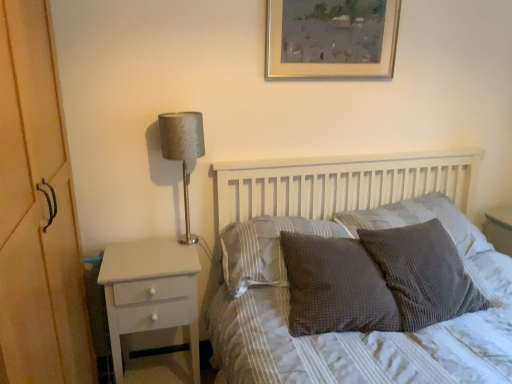
Question: Is the depth of satin silver lamp at left less than that of textured gray pillow at center, the 3th pillow viewed from the right?

Choices:
 (A) no
 (B) yes

Answer: (A)

Question: From the image's perspective, does satin silver lamp at left appear higher than textured gray pillow at center, marked as the 2th pillow in a left-to-right arrangement?

Choices:
 (A) no
 (B) yes

Answer: (B)

Question: Considering the relative sizes of satin silver lamp at left and textured gray pillow at center, marked as the 2th pillow in a left-to-right arrangement, in the image provided, is satin silver lamp at left smaller than textured gray pillow at center, marked as the 2th pillow in a left-to-right arrangement,?

Choices:
 (A) yes
 (B) no

Answer: (A)

Question: From a real-world perspective, is satin silver lamp at left positioned over textured gray pillow at center, the 3th pillow viewed from the right, based on gravity?

Choices:
 (A) yes
 (B) no

Answer: (A)

Question: Does satin silver lamp at left have a greater width compared to textured gray pillow at center, marked as the 2th pillow in a left-to-right arrangement?

Choices:
 (A) yes
 (B) no

Answer: (B)

Question: Considering the positions of white painted wood nightstand at left and textured gray pillow at center, which is the 4th pillow in right-to-left order, in the image, is white painted wood nightstand at left bigger or smaller than textured gray pillow at center, which is the 4th pillow in right-to-left order,?

Choices:
 (A) small
 (B) big

Answer: (B)

Question: In terms of width, does white painted wood nightstand at left look wider or thinner when compared to textured gray pillow at center, which is counted as the 1th pillow, starting from the left?

Choices:
 (A) thin
 (B) wide

Answer: (B)

Question: From a real-world perspective, is white painted wood nightstand at left physically located above or below textured gray pillow at center, which is counted as the 1th pillow, starting from the left?

Choices:
 (A) above
 (B) below

Answer: (B)

Question: In the image, is white painted wood nightstand at left on the left side or the right side of textured gray pillow at center, which is counted as the 1th pillow, starting from the left?

Choices:
 (A) left
 (B) right

Answer: (A)

Question: Is satin silver lamp at left bigger or smaller than textured gray pillow at center, the first pillow positioned from the right?

Choices:
 (A) big
 (B) small

Answer: (B)

Question: Does point (174, 132) appear closer or farther from the camera than point (333, 215)?

Choices:
 (A) closer
 (B) farther

Answer: (A)

Question: Is satin silver lamp at left spatially inside textured gray pillow at center, which is counted as the fourth pillow, starting from the left, or outside of it?

Choices:
 (A) outside
 (B) inside

Answer: (A)

Question: From their relative heights in the image, would you say satin silver lamp at left is taller or shorter than textured gray pillow at center, the first pillow positioned from the right?

Choices:
 (A) short
 (B) tall

Answer: (B)

Question: Considering the positions of point (187, 150) and point (372, 26), is point (187, 150) closer or farther from the camera than point (372, 26)?

Choices:
 (A) closer
 (B) farther

Answer: (A)

Question: Visually, is satin silver lamp at left positioned to the left or to the right of gold/golden frame at upper center?

Choices:
 (A) right
 (B) left

Answer: (B)